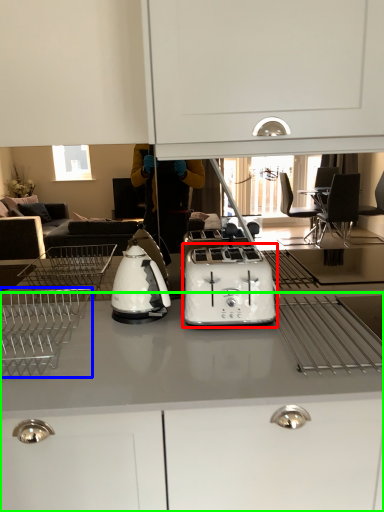
Question: Estimate the real-world distances between objects in this image. Which object is farther from toaster (highlighted by a red box), home appliance (highlighted by a blue box) or cabinetry (highlighted by a green box)?

Choices:
 (A) home appliance
 (B) cabinetry

Answer: (A)